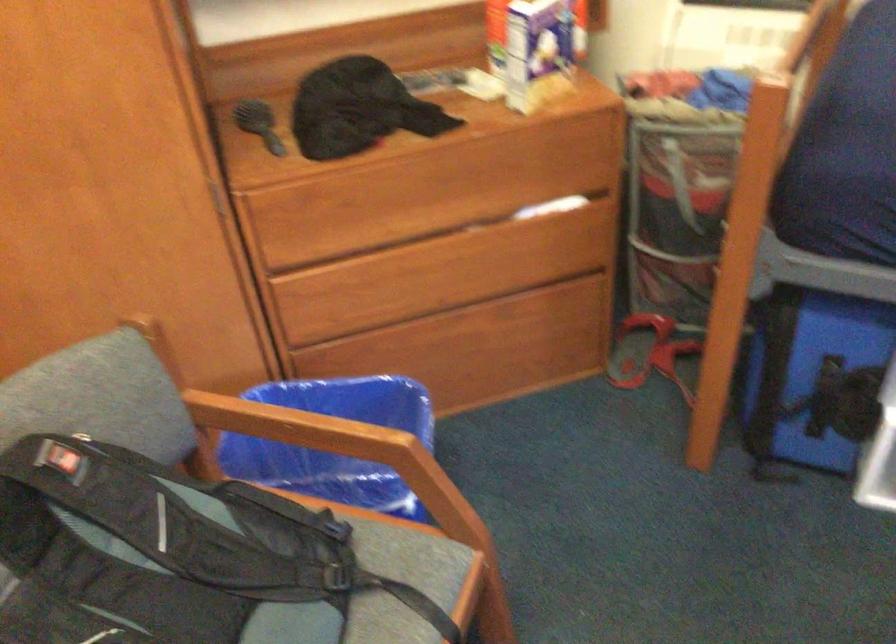
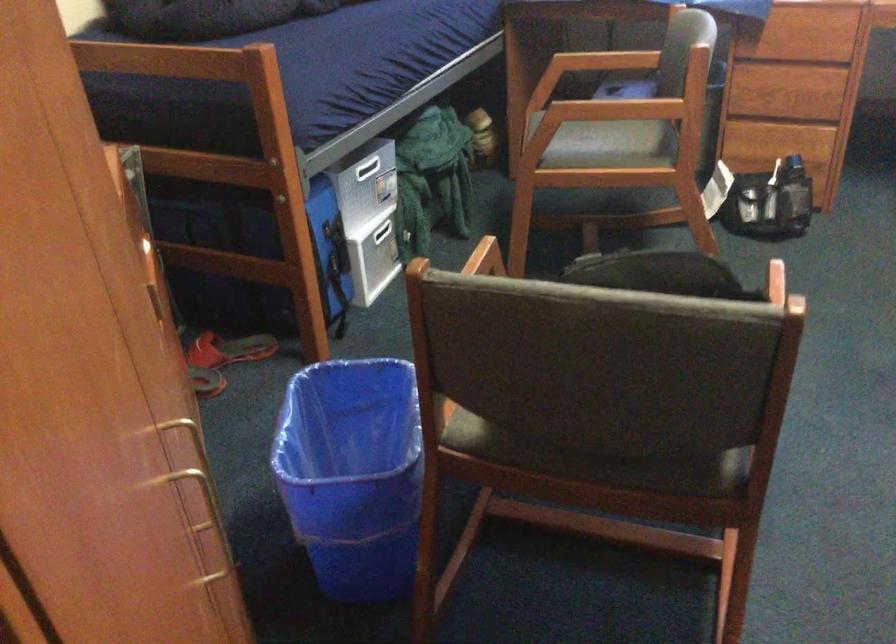
The point at (630, 377) is marked in the first image. Where is the corresponding point in the second image?

(205, 381)